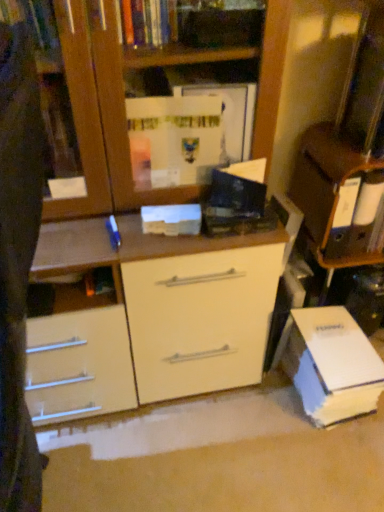
Question: Is white glossy cabinet at upper right spatially inside white cardboard book at lower right, arranged as the 2th paperback book when viewed from the front, or outside of it?

Choices:
 (A) outside
 (B) inside

Answer: (A)

Question: Is white glossy cabinet at upper right in front of or behind white cardboard book at lower right, which is counted as the first paperback book, starting from the right, in the image?

Choices:
 (A) front
 (B) behind

Answer: (A)

Question: Based on their relative distances, which object is nearer to the white glossy cabinet at upper right?

Choices:
 (A) white cardboard book at lower right, which is counted as the first paperback book, starting from the right
 (B) white matte paperback book at center, which is the first paperback book from top to bottom

Answer: (A)

Question: Considering the real-world distances, which object is closest to the white glossy cabinet at upper right?

Choices:
 (A) white cardboard book at lower right, which is counted as the first paperback book, starting from the right
 (B) white matte paperback book at center, the second paperback book in the right-to-left sequence

Answer: (A)